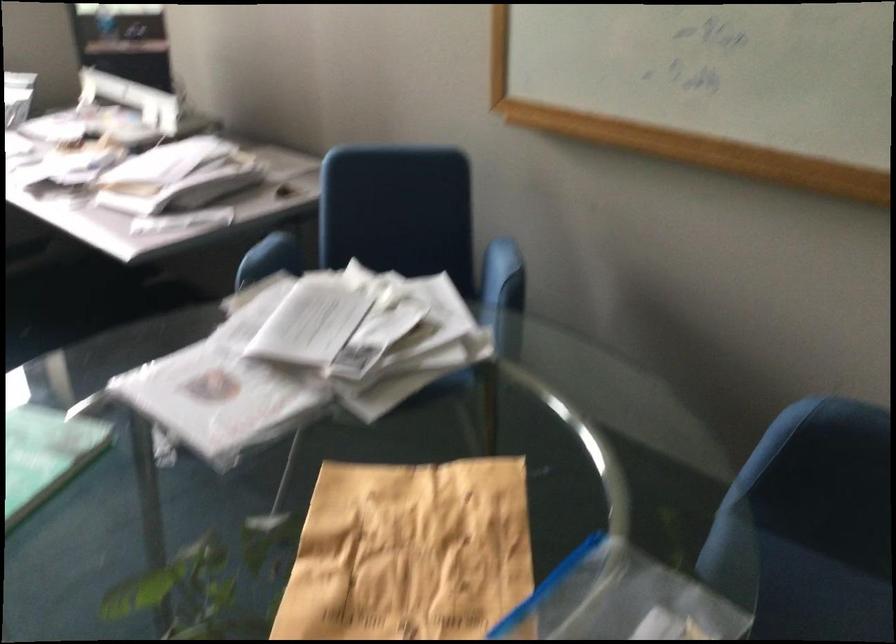
The height and width of the screenshot is (644, 896). I want to click on crumpled paper envelope, so click(409, 552).